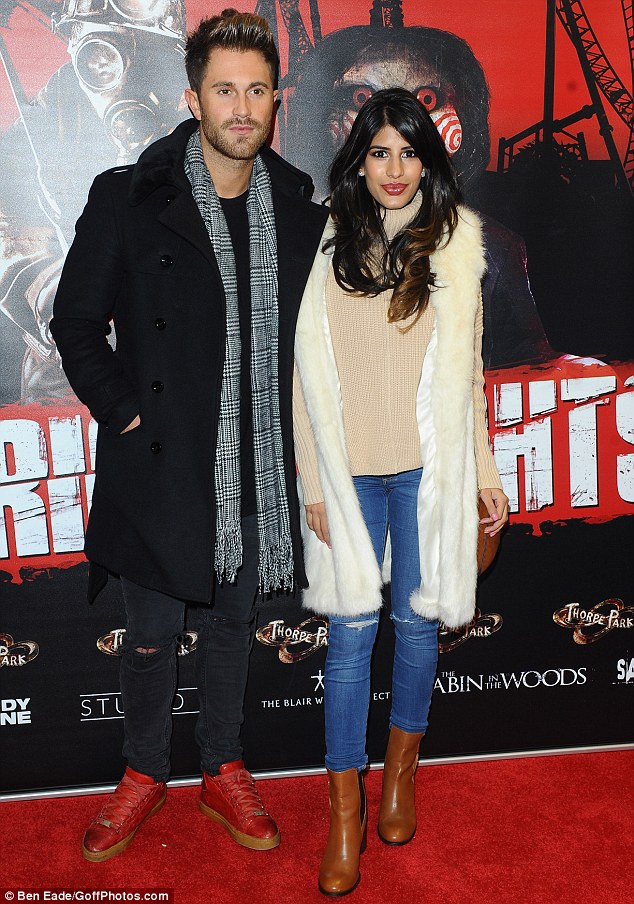
At what (x,y) coordinates should I click in order to perform the action: click on red carpet. Please return your answer as a coordinate pair (x, y). This screenshot has width=634, height=904. Looking at the image, I should click on (536, 850).